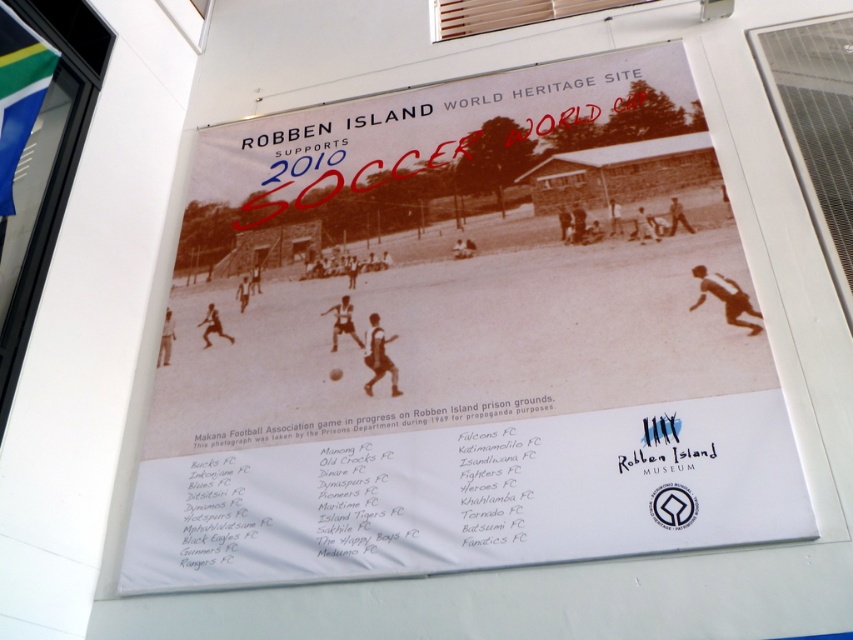
Can you confirm if black paper poster at center is positioned below green fabric flag at upper left?

Yes.

Image resolution: width=853 pixels, height=640 pixels. I want to click on black paper poster at center, so click(x=461, y=339).

Consider the image. Who is more forward, (408,392) or (4,180)?

Positioned in front is point (4,180).

Locate an element on the screen. The height and width of the screenshot is (640, 853). black paper poster at center is located at coordinates [461, 339].